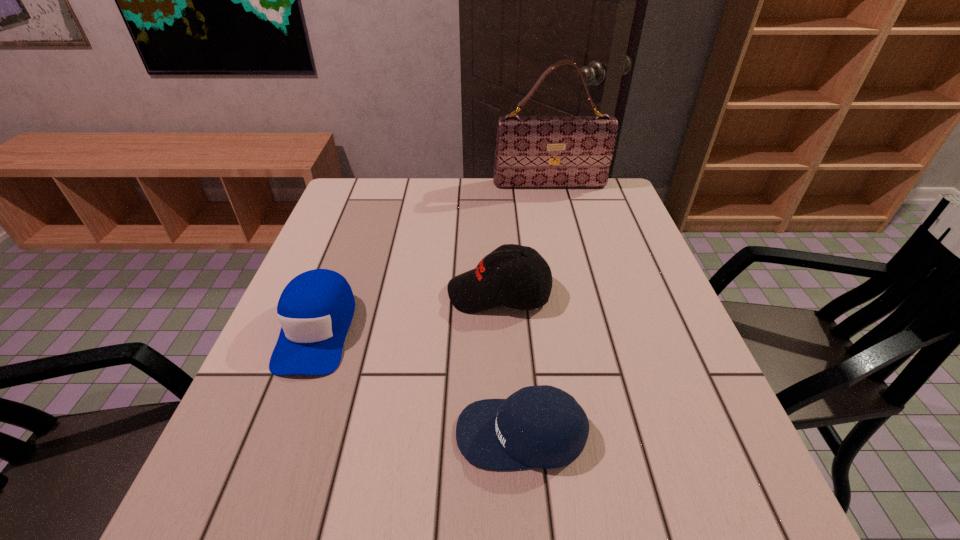
In order to click on vacant space located 0.230m on the front-facing side of the shortest baseball cap in this screenshot , I will do `click(323, 433)`.

You are a GUI agent. You are given a task and a screenshot of the screen. Output one action in this format:
    pyautogui.click(x=<x>, y=<y>)
    Task: Click on the object positioned at the far edge
    The height and width of the screenshot is (540, 960).
    Given the screenshot: What is the action you would take?
    pyautogui.click(x=531, y=151)

The width and height of the screenshot is (960, 540). In order to click on object that is positioned at the left edge in this screenshot , I will do `click(315, 309)`.

Find the location of a particular element. Image resolution: width=960 pixels, height=540 pixels. object that is at the right edge is located at coordinates (531, 151).

You are a GUI agent. You are given a task and a screenshot of the screen. Output one action in this format:
    pyautogui.click(x=<x>, y=<y>)
    Task: Click on the object located at the far right corner
    The image size is (960, 540).
    Given the screenshot: What is the action you would take?
    pyautogui.click(x=531, y=151)

In the image, there is a desktop. Find the location of `vacant space at the far edge`. vacant space at the far edge is located at coordinates coord(488,208).

In the image, there is a desktop. Find the location of `free region at the near edge`. free region at the near edge is located at coordinates point(350,516).

Locate an element on the screen. This screenshot has width=960, height=540. free location at the left edge of the desktop is located at coordinates (257, 417).

Where is `vacant region at the right edge of the desktop`? Image resolution: width=960 pixels, height=540 pixels. vacant region at the right edge of the desktop is located at coordinates (668, 306).

The height and width of the screenshot is (540, 960). I want to click on vacant space at the far left corner of the desktop, so click(x=381, y=202).